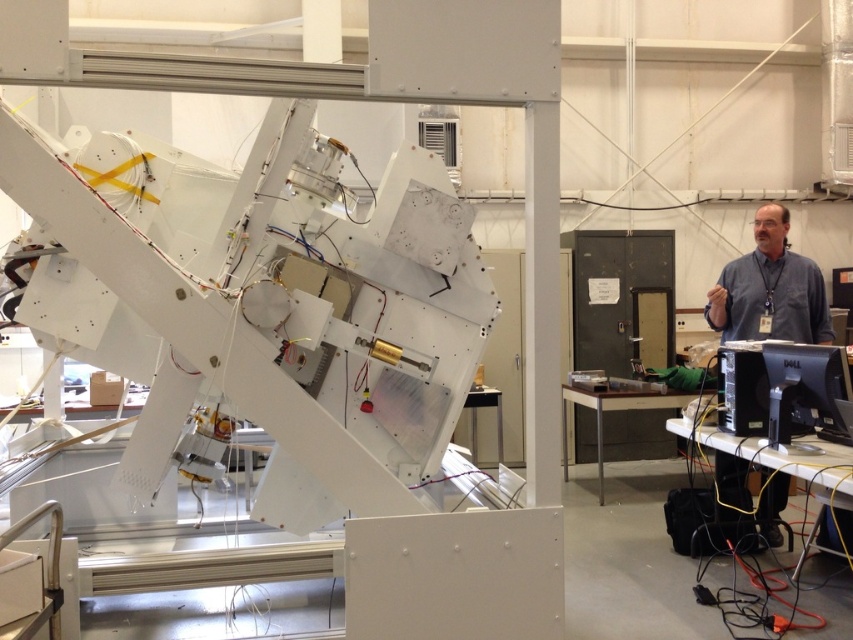
Question: Can you confirm if gray shirt at right is thinner than blue shirt at right?

Choices:
 (A) no
 (B) yes

Answer: (B)

Question: Among these objects, which one is farthest from the camera?

Choices:
 (A) gray shirt at right
 (B) blue shirt at right

Answer: (B)

Question: Which point is farther to the camera?

Choices:
 (A) pos(811,259)
 (B) pos(815,268)

Answer: (A)

Question: Can you confirm if gray shirt at right is bigger than blue shirt at right?

Choices:
 (A) no
 (B) yes

Answer: (B)

Question: Which point appears farthest from the camera in this image?

Choices:
 (A) (722, 481)
 (B) (815, 304)

Answer: (A)

Question: Does gray shirt at right have a larger size compared to blue shirt at right?

Choices:
 (A) no
 (B) yes

Answer: (B)